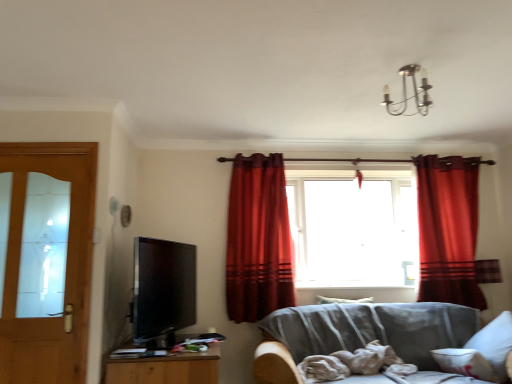
Question: Does transparent glass window at center appear on the right side of satin red curtain at right, placed as the second curtain when sorted from left to right?

Choices:
 (A) yes
 (B) no

Answer: (B)

Question: Considering the relative sizes of transparent glass window at center and satin red curtain at right, placed as the second curtain when sorted from left to right, in the image provided, is transparent glass window at center shorter than satin red curtain at right, placed as the second curtain when sorted from left to right,?

Choices:
 (A) yes
 (B) no

Answer: (A)

Question: Is transparent glass window at center positioned with its back to satin red curtain at right, marked as the 1th curtain in a right-to-left arrangement?

Choices:
 (A) yes
 (B) no

Answer: (B)

Question: Would you say transparent glass window at center is outside satin red curtain at right, placed as the second curtain when sorted from left to right?

Choices:
 (A) yes
 (B) no

Answer: (A)

Question: Can you confirm if transparent glass window at center is bigger than satin red curtain at right, marked as the 1th curtain in a right-to-left arrangement?

Choices:
 (A) no
 (B) yes

Answer: (B)

Question: Is transparent glass window at center taller or shorter than light brown wooden door at left?

Choices:
 (A) short
 (B) tall

Answer: (A)

Question: From a real-world perspective, is transparent glass window at center physically located above or below light brown wooden door at left?

Choices:
 (A) above
 (B) below

Answer: (A)

Question: In terms of width, does transparent glass window at center look wider or thinner when compared to light brown wooden door at left?

Choices:
 (A) thin
 (B) wide

Answer: (B)

Question: Considering their positions, is transparent glass window at center located in front of or behind light brown wooden door at left?

Choices:
 (A) front
 (B) behind

Answer: (B)

Question: Would you say gray fabric couch at lower right is to the left or to the right of velvet red curtain at center, positioned as the 1th curtain in left-to-right order, in the picture?

Choices:
 (A) right
 (B) left

Answer: (A)

Question: From their relative heights in the image, would you say gray fabric couch at lower right is taller or shorter than velvet red curtain at center, the 2th curtain from the right?

Choices:
 (A) short
 (B) tall

Answer: (A)

Question: Is point (401, 322) positioned closer to the camera than point (246, 276)?

Choices:
 (A) closer
 (B) farther

Answer: (A)

Question: Based on their sizes in the image, would you say gray fabric couch at lower right is bigger or smaller than velvet red curtain at center, positioned as the 1th curtain in left-to-right order?

Choices:
 (A) small
 (B) big

Answer: (B)

Question: Is wooden cabinet at lower left to the left or to the right of gray fabric couch at lower right in the image?

Choices:
 (A) left
 (B) right

Answer: (A)

Question: Is wooden cabinet at lower left situated inside gray fabric couch at lower right or outside?

Choices:
 (A) outside
 (B) inside

Answer: (A)